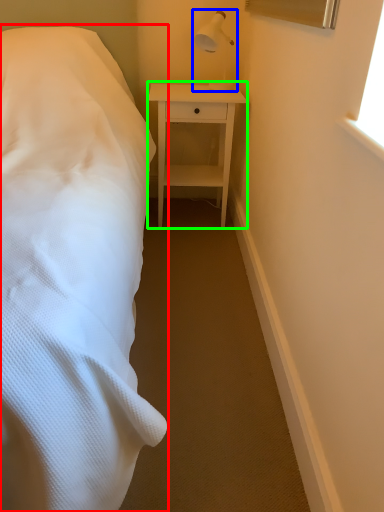
Question: Which is nearer to the bed (highlighted by a red box)? bedside lamp (highlighted by a blue box) or nightstand (highlighted by a green box).

Choices:
 (A) bedside lamp
 (B) nightstand

Answer: (B)